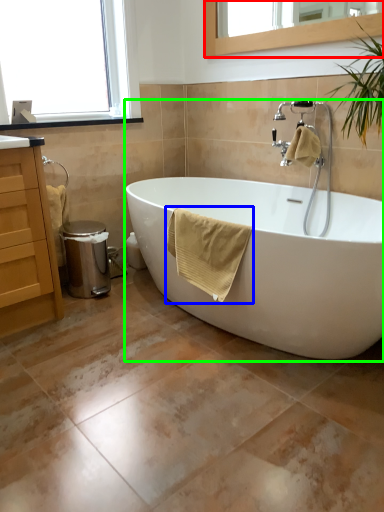
Question: Which object is positioned farthest from mirror (highlighted by a red box)? Select from bath towel (highlighted by a blue box) and bathtub (highlighted by a green box).

Choices:
 (A) bath towel
 (B) bathtub

Answer: (B)